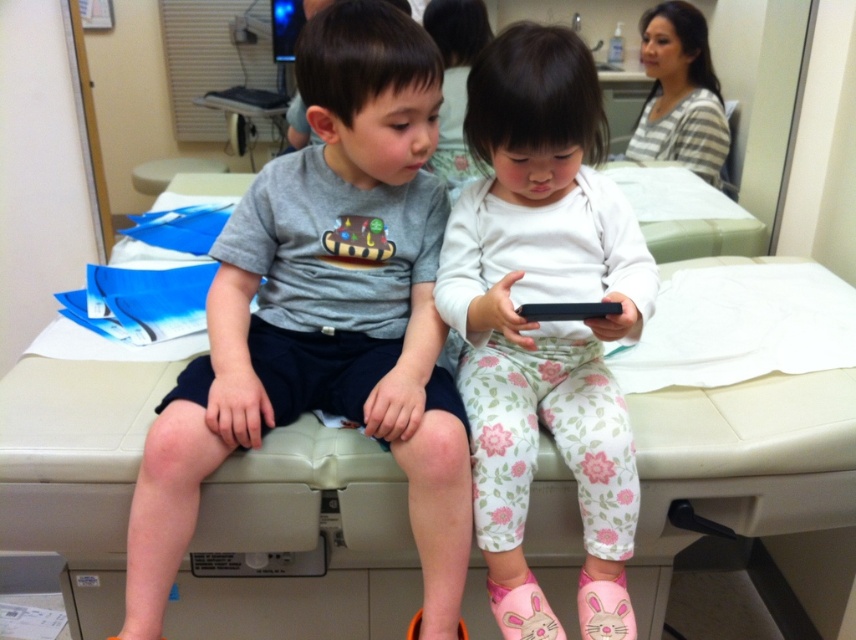
Is point (395, 204) farther from viewer compared to point (531, 304)?

That is True.

Is gray matte shirt at center further to the viewer compared to black matte smartphone at center?

Yes, gray matte shirt at center is behind black matte smartphone at center.

Locate an element on the screen. This screenshot has width=856, height=640. gray matte shirt at center is located at coordinates (325, 316).

Is point (486, 128) more distant than point (586, 308)?

Yes, point (486, 128) is behind point (586, 308).

Does white floral leggings at center have a greater width compared to black matte smartphone at center?

Correct, the width of white floral leggings at center exceeds that of black matte smartphone at center.

Where is `white floral leggings at center`? The height and width of the screenshot is (640, 856). white floral leggings at center is located at coordinates (544, 321).

Which is in front, point (395, 134) or point (622, 291)?

Point (395, 134) is in front.

Is the position of gray matte shirt at center more distant than that of white floral leggings at center?

That is True.

Image resolution: width=856 pixels, height=640 pixels. I want to click on gray matte shirt at center, so click(325, 316).

Image resolution: width=856 pixels, height=640 pixels. Identify the location of gray matte shirt at center. coord(325,316).